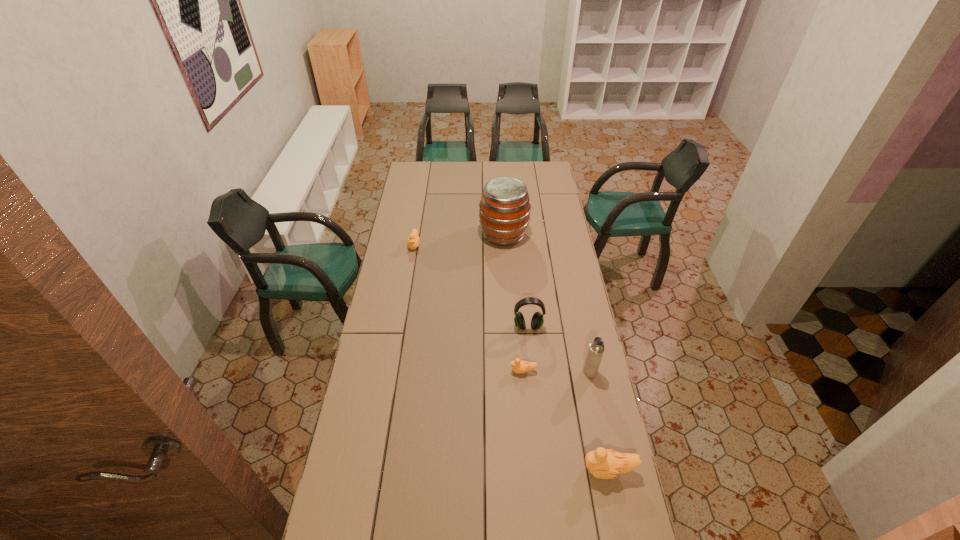
Find the location of a particular element. The width and height of the screenshot is (960, 540). object that is positioned at the left edge is located at coordinates (413, 240).

You are a GUI agent. You are given a task and a screenshot of the screen. Output one action in this format:
    pyautogui.click(x=<x>, y=<y>)
    Task: Click on the duckling present at the right edge
    The width and height of the screenshot is (960, 540).
    Given the screenshot: What is the action you would take?
    pyautogui.click(x=603, y=463)

I want to click on thermos bottle at the right edge, so click(596, 349).

The height and width of the screenshot is (540, 960). In order to click on free space at the far edge of the desktop in this screenshot , I will do `click(440, 161)`.

Locate an element on the screen. vacant area at the left edge of the desktop is located at coordinates (387, 322).

Where is `free region at the right edge of the desktop`? free region at the right edge of the desktop is located at coordinates (545, 275).

Identify the location of free space at the far left corner of the desktop. Image resolution: width=960 pixels, height=540 pixels. (411, 163).

Where is `free region at the far right corner`? Image resolution: width=960 pixels, height=540 pixels. free region at the far right corner is located at coordinates (543, 172).

The height and width of the screenshot is (540, 960). I want to click on unoccupied position between the leftmost duckling and the nearest duckling, so click(x=512, y=357).

Find the location of a particular element. vacant area between the tallest object and the thermos bottle is located at coordinates (547, 303).